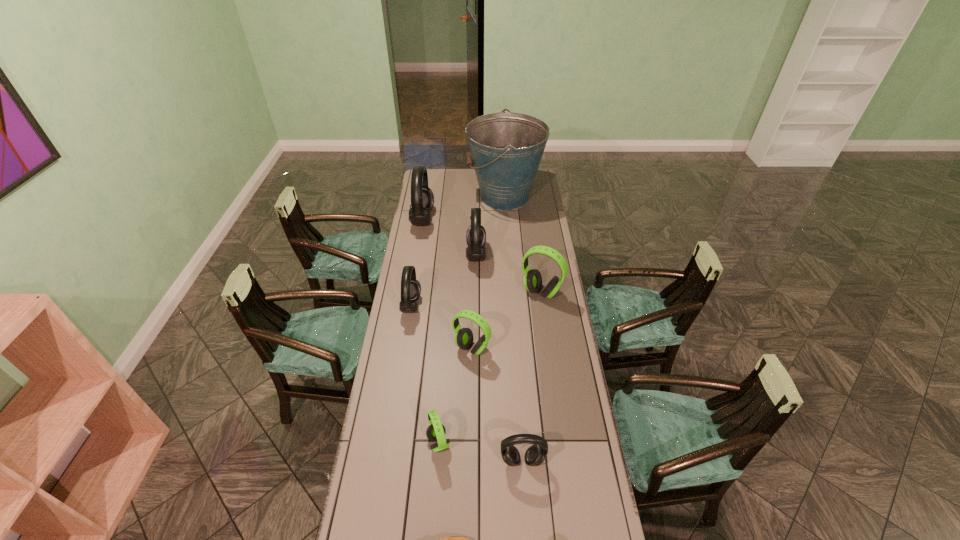
Find the location of `free region located 0.080m on the left of the third nearest headset`. free region located 0.080m on the left of the third nearest headset is located at coordinates (433, 348).

Locate an element on the screen. This screenshot has width=960, height=540. vacant region located 0.150m on the right of the nearest green headset is located at coordinates (494, 443).

What are the coordinates of `vacant space located 0.190m on the earcups of the nearest gray headset` in the screenshot? It's located at (528, 535).

Identify the location of object that is at the far edge. This screenshot has width=960, height=540. (506, 148).

Find the location of a particular element. This screenshot has width=960, height=540. bucket at the right edge is located at coordinates (506, 148).

At what (x,y) coordinates should I click in order to perform the action: click on headset located in the right edge section of the desktop. Please return your answer as a coordinate pair (x, y). The image size is (960, 540). Looking at the image, I should click on coord(532,280).

In order to click on object that is positioned at the far right corner in this screenshot , I will do `click(506, 148)`.

In the image, there is a desktop. Find the location of `free space at the left edge`. free space at the left edge is located at coordinates (420, 261).

Where is `free space at the right edge of the desktop`? The image size is (960, 540). free space at the right edge of the desktop is located at coordinates 569,333.

Locate an element on the screen. This screenshot has height=540, width=960. free space between the rightmost gray headset and the smallest green headset is located at coordinates (480, 451).